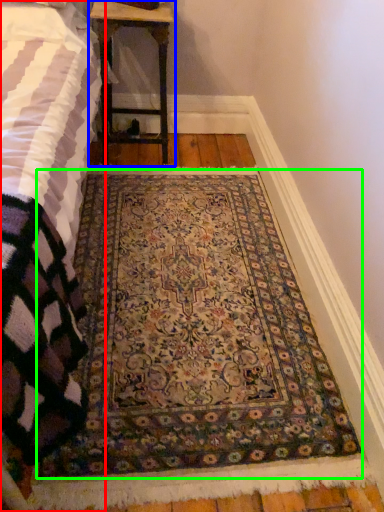
Question: Based on their relative distances, which object is nearer to bed (highlighted by a red box)? Choose from table (highlighted by a blue box) and mat (highlighted by a green box).

Choices:
 (A) table
 (B) mat

Answer: (B)